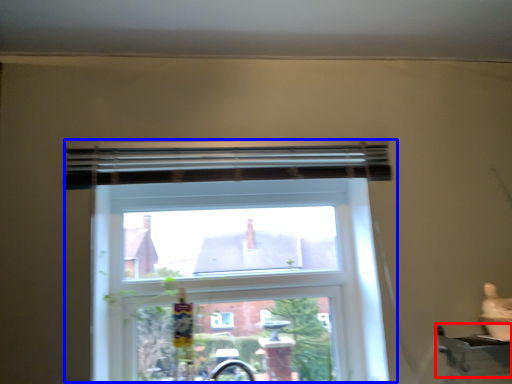
Question: Which of the following is the farthest to the observer, window sill (highlighted by a red box) or window (highlighted by a blue box)?

Choices:
 (A) window sill
 (B) window

Answer: (B)